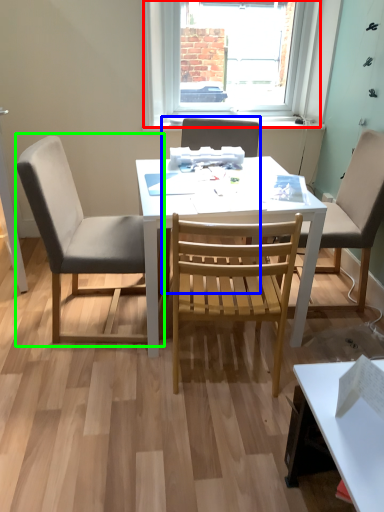
Question: Estimate the real-world distances between objects in this image. Which object is farther from window (highlighted by a red box), chair (highlighted by a blue box) or chair (highlighted by a green box)?

Choices:
 (A) chair
 (B) chair

Answer: (B)